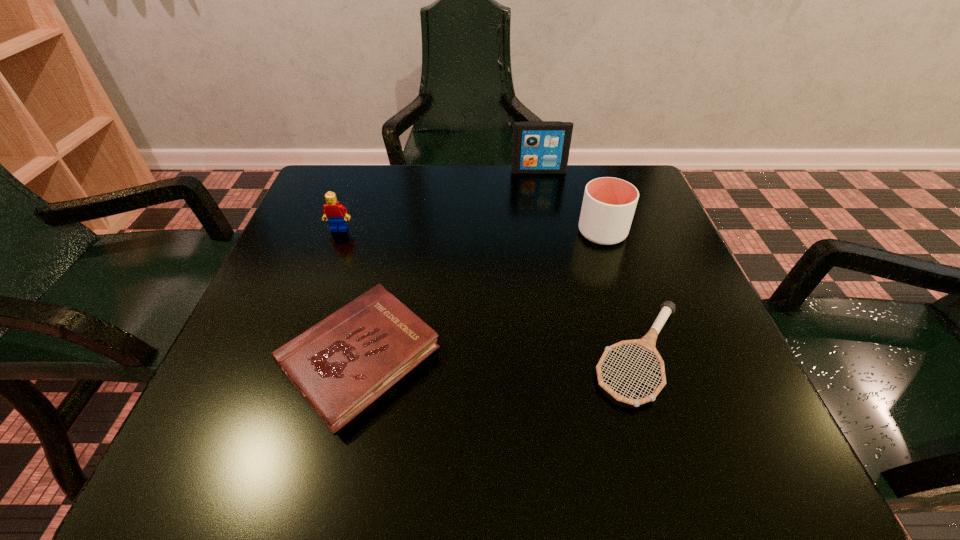
You are a GUI agent. You are given a task and a screenshot of the screen. Output one action in this format:
    pyautogui.click(x=<x>, y=<y>)
    Task: Click on the vacant space that satisfies the following two spatial constraints: 1. on the front-facing side of the Lego; 2. on the right side of the cup
    
    Given the screenshot: What is the action you would take?
    pyautogui.click(x=338, y=232)

Find the location of a particular element. The height and width of the screenshot is (540, 960). free space in the image that satisfies the following two spatial constraints: 1. on the front-facing side of the Lego; 2. on the right side of the tennis racket is located at coordinates point(293,354).